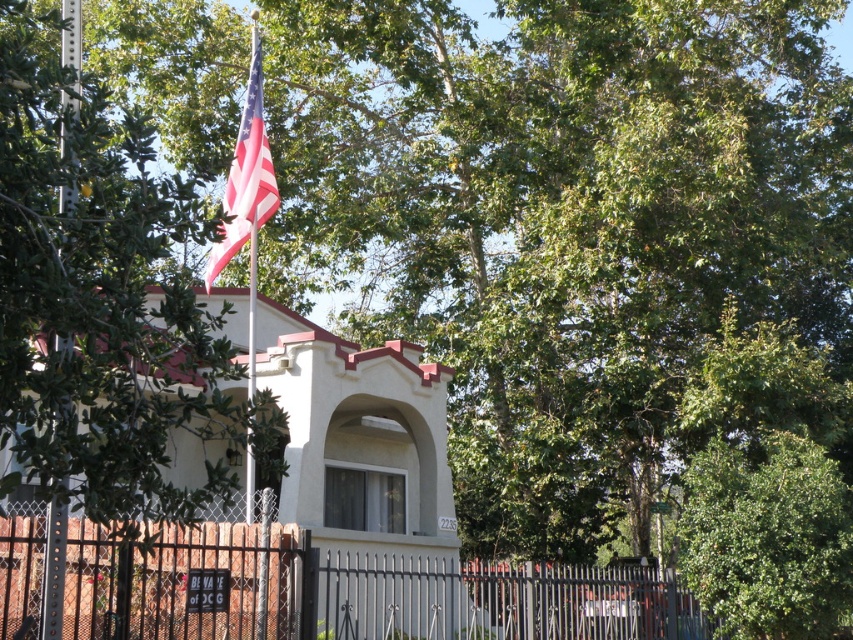
Question: Which object is positioned farthest from the american flag at upper center?

Choices:
 (A) metallic chain-link fence at lower center
 (B) metallic silver flag pole at left

Answer: (B)

Question: Does metallic chain-link fence at lower center appear under american flag at upper center?

Choices:
 (A) no
 (B) yes

Answer: (B)

Question: Which point is closer to the camera?

Choices:
 (A) (94, 586)
 (B) (56, 499)
 (C) (264, 214)

Answer: (B)

Question: Which object is farther from the camera taking this photo?

Choices:
 (A) metallic silver flag pole at left
 (B) american flag at upper center

Answer: (B)

Question: Is metallic chain-link fence at lower center below metallic silver flag pole at left?

Choices:
 (A) no
 (B) yes

Answer: (B)

Question: Is metallic chain-link fence at lower center smaller than american flag at upper center?

Choices:
 (A) no
 (B) yes

Answer: (A)